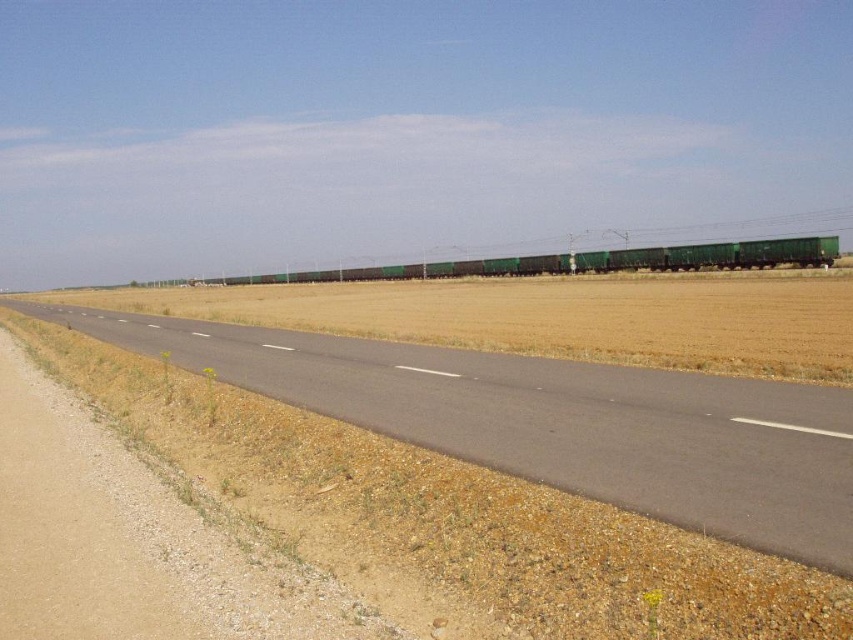
Question: Which point is farther to the camera?

Choices:
 (A) green matte train carriages at center
 (B) brown grassland at center
 (C) asphalt road at center

Answer: (A)

Question: Which object is the farthest from the asphalt road at center?

Choices:
 (A) brown grassland at center
 (B) green matte train carriages at center

Answer: (B)

Question: Is asphalt road at center to the right of brown grassland at center from the viewer's perspective?

Choices:
 (A) yes
 (B) no

Answer: (A)

Question: Which point is farther from the camera taking this photo?

Choices:
 (A) (585, 332)
 (B) (421, 266)
 (C) (427, 381)

Answer: (B)

Question: Is asphalt road at center to the left of green matte train carriages at center from the viewer's perspective?

Choices:
 (A) yes
 (B) no

Answer: (B)

Question: Is asphalt road at center closer to camera compared to green matte train carriages at center?

Choices:
 (A) no
 (B) yes

Answer: (B)